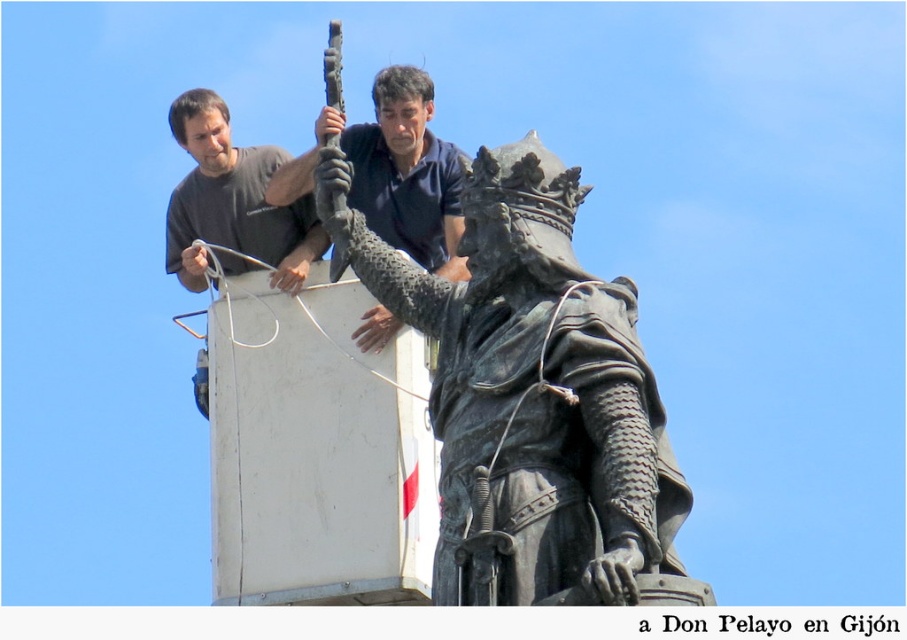
You are a visitor at an art gallery and see the bronze statue at center and the matte black shirt at upper center. Which object appears larger in the image?

The matte black shirt at upper center appears larger than the bronze statue at center in the image.

You are standing at the point with coordinates (533, 397) in the image. What object are you directly at?

The point at coordinates (533, 397) is directly at the bronze statue at center.

You are a visitor at an art gallery and see the bronze statue at center and the matte black shirt at upper center. Which object is wider?

The bronze statue at center is wider than the matte black shirt at upper center.